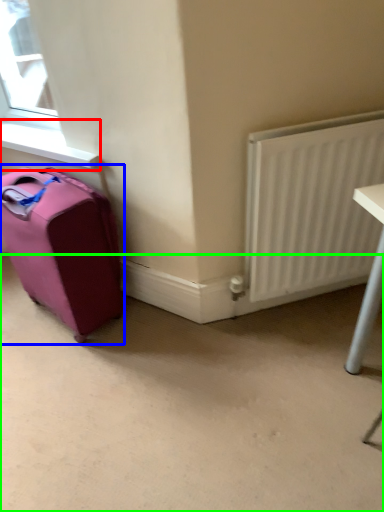
Question: Considering the real-world distances, which object is farthest from window sill (highlighted by a red box)? luggage and bags (highlighted by a blue box) or concrete (highlighted by a green box)?

Choices:
 (A) luggage and bags
 (B) concrete

Answer: (B)